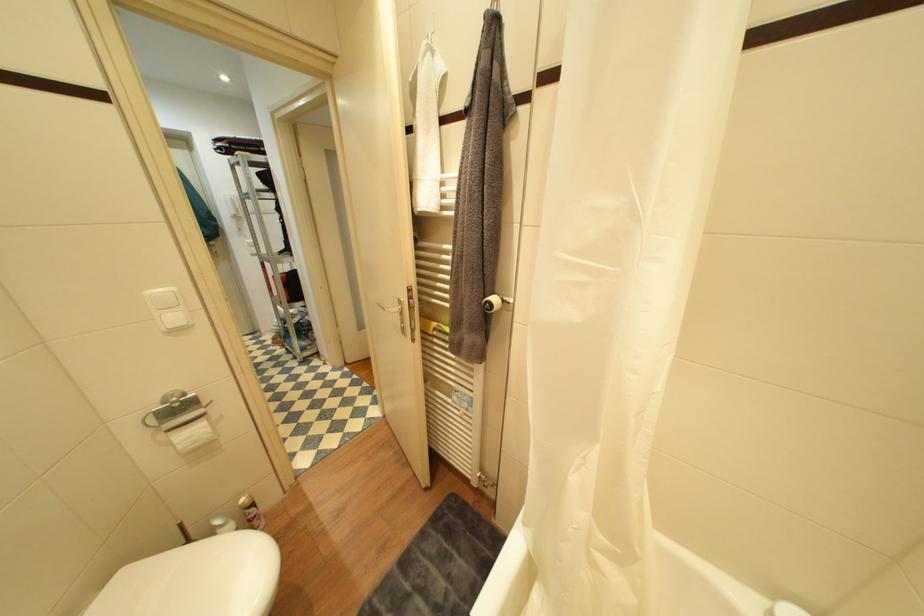
The location [492,302] corresponds to which object?

It corresponds to the toilet paper roll in the image.